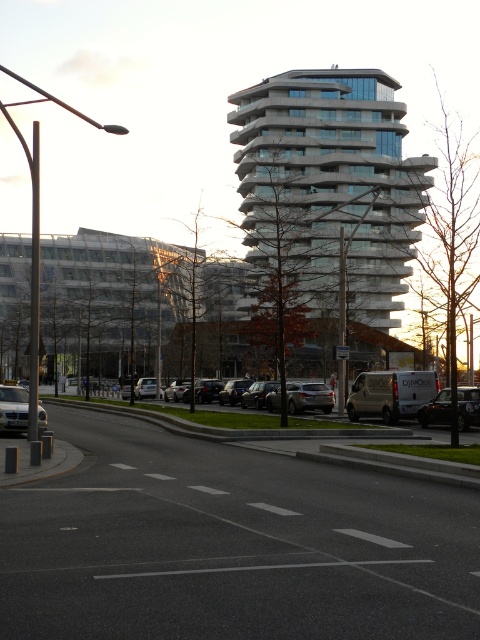
Who is higher up, white glass building at center or silver metallic van at center?

white glass building at center is higher up.

Who is more distant from viewer, (323, 170) or (171, 406)?

The point (323, 170) is more distant.

Find the location of a particular element. white glass building at center is located at coordinates (331, 182).

Is silver metallic van at center closer to camera compared to shiny black sedan at right?

Yes, silver metallic van at center is in front of shiny black sedan at right.

Can you confirm if silver metallic van at center is wider than shiny black sedan at right?

Yes.

Find the location of a particular element. silver metallic van at center is located at coordinates (409, 396).

Can you confirm if satin silver sedan at center is smaller than shiny silver sedan at center?

Incorrect, satin silver sedan at center is not smaller in size than shiny silver sedan at center.

You are a GUI agent. You are given a task and a screenshot of the screen. Output one action in this format:
    pyautogui.click(x=<x>, y=<y>)
    Task: Click on the satin silver sedan at center
    
    Given the screenshot: What is the action you would take?
    pyautogui.click(x=309, y=396)

What are the coordinates of `satin silver sedan at center` in the screenshot? It's located at (309, 396).